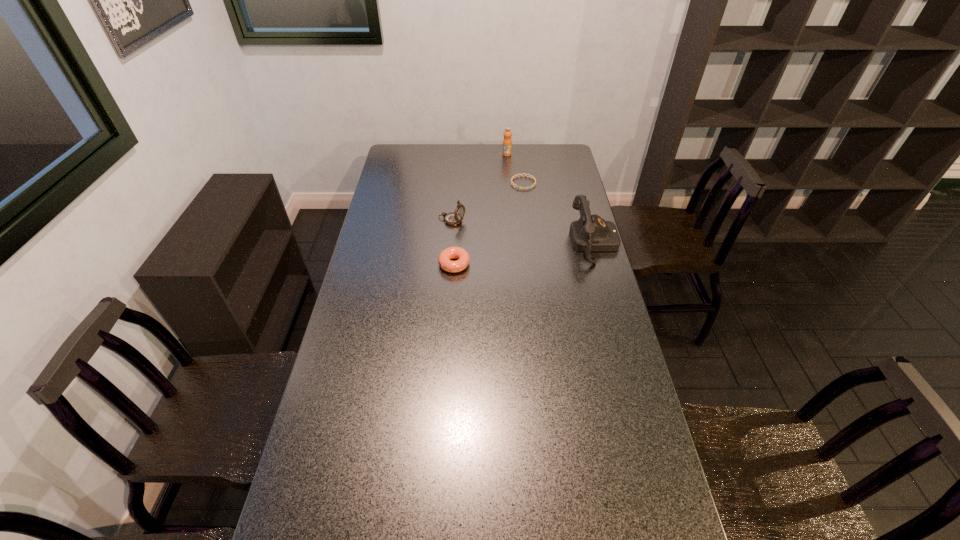
What are the coordinates of `free point located on the front label of the farthest object` in the screenshot? It's located at (509, 167).

This screenshot has width=960, height=540. What are the coordinates of `free location located on the face of the compass` in the screenshot? It's located at (538, 251).

Locate an element on the screen. vacant space situated 0.170m on the face of the compass is located at coordinates (499, 237).

I want to click on free spot located on the face of the compass, so click(x=489, y=233).

This screenshot has height=540, width=960. In order to click on free space located on the surface of the bracelet showing star-shaped elements in this screenshot , I will do `click(530, 228)`.

Where is `free region located 0.050m on the surface of the bracelet showing star-shaped elements`? The image size is (960, 540). free region located 0.050m on the surface of the bracelet showing star-shaped elements is located at coordinates (525, 197).

At what (x,y) coordinates should I click in order to perform the action: click on vacant region located on the surface of the bracelet showing star-shaped elements. Please return your answer as a coordinate pair (x, y). This screenshot has height=540, width=960. Looking at the image, I should click on (528, 212).

You are a GUI agent. You are given a task and a screenshot of the screen. Output one action in this format:
    pyautogui.click(x=<x>, y=<y>)
    Task: Click on the object that is at the far edge
    The image size is (960, 540).
    Given the screenshot: What is the action you would take?
    pyautogui.click(x=507, y=142)

Image resolution: width=960 pixels, height=540 pixels. Find the location of `object present at the right edge`. object present at the right edge is located at coordinates (590, 233).

At what (x,y) coordinates should I click in order to perform the action: click on vacant space at the far edge of the desktop. Please return your answer as a coordinate pair (x, y). Looking at the image, I should click on 519,167.